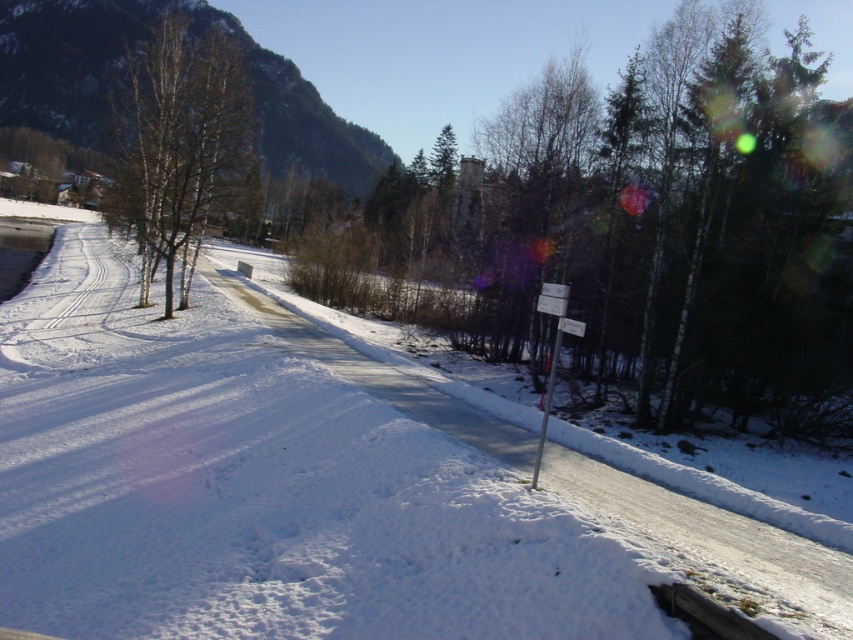
You are planning to build a snowman using the white snow at center and the bare birch trees at left as landmarks. Which area has enough space to build the snowman?

The bare birch trees at left have a greater width than the white snow at center, so the area near the bare birch trees at left has more space to build the snowman.